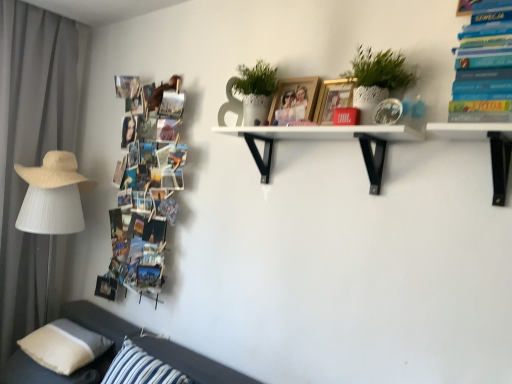
Locate an element on the screen. vacant space underneath wooden photo collage at left, the 2th book in the right-to-left sequence (from a real-world perspective) is located at coordinates (122, 319).